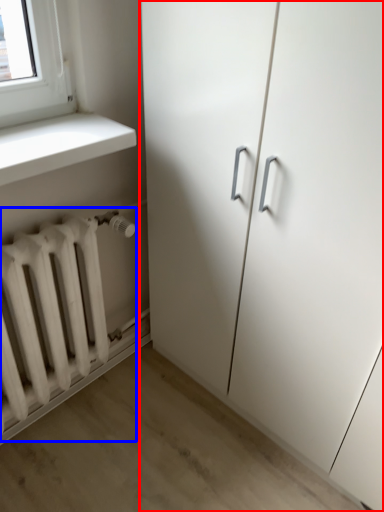
Question: Among these objects, which one is farthest to the camera, cupboard (highlighted by a red box) or radiator (highlighted by a blue box)?

Choices:
 (A) cupboard
 (B) radiator

Answer: (B)